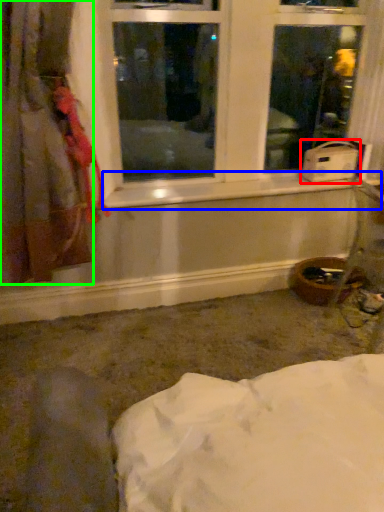
Question: Which is nearer to the water heater (highlighted by a red box)? window sill (highlighted by a blue box) or curtain (highlighted by a green box).

Choices:
 (A) window sill
 (B) curtain

Answer: (A)